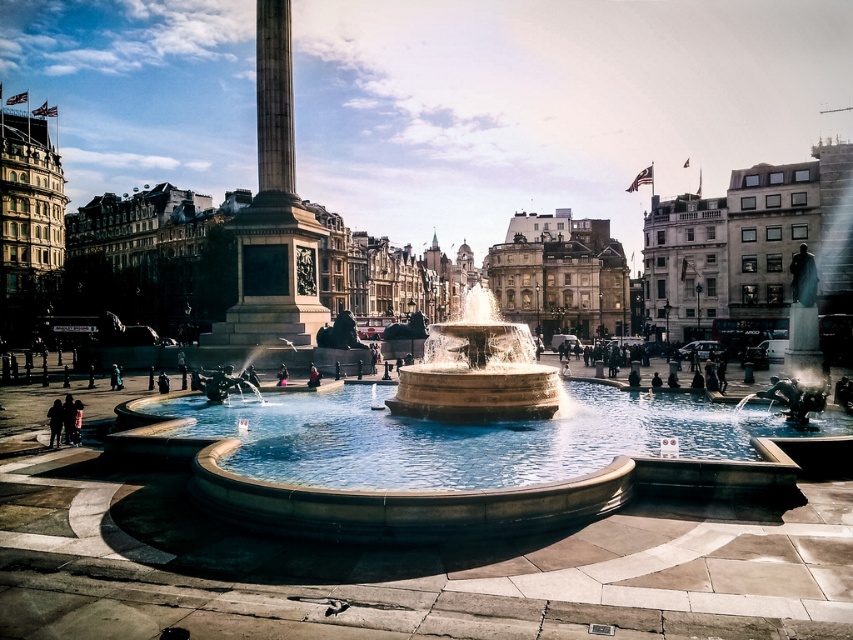
You are standing at the point marked by the coordinates (273, 212) in Trafalgar Square. What structure are you closest to?

The point marked by the coordinates (273, 212) is closest to the smooth stone obelisk at center.

You are a tailor who needs to determine which coat requires more fabric to make. Based on the scene, which coat would need more fabric, the red velvet coat at center or the dark fabric coat at center?

The dark fabric coat at center requires more fabric because it is wider than the red velvet coat at center.